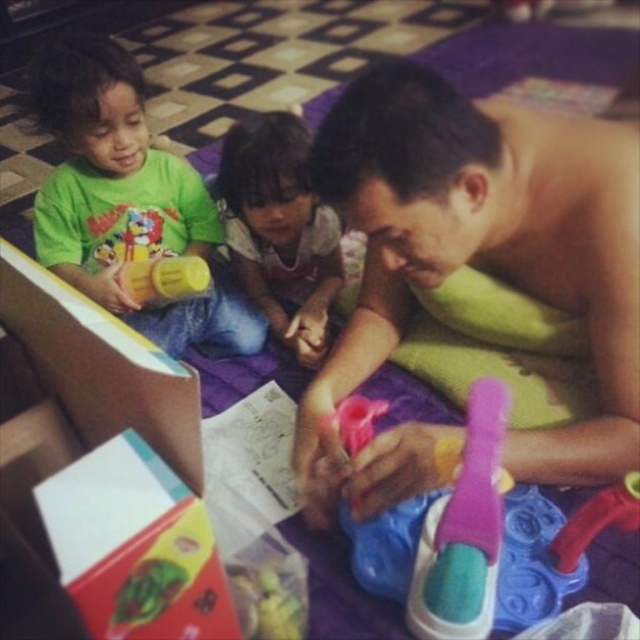
Question: Estimate the real-world distances between objects in this image. Which object is farther from the matte white shirt at center?

Choices:
 (A) matte green box at lower left
 (B) pink plastic toy at center

Answer: (A)

Question: Does matte green box at lower left have a larger size compared to pink rubber toothbrush at center?

Choices:
 (A) no
 (B) yes

Answer: (A)

Question: Which point is closer to the camera taking this photo?

Choices:
 (A) (291, 218)
 (B) (35, 486)

Answer: (B)

Question: Considering the relative positions of pink plastic brush at center and pink rubber toothbrush at center in the image provided, where is pink plastic brush at center located with respect to pink rubber toothbrush at center?

Choices:
 (A) right
 (B) left

Answer: (A)

Question: Which point is farther to the camera?

Choices:
 (A) (547, 317)
 (B) (531, 544)

Answer: (A)

Question: Is pink plastic brush at center thinner than pink plastic toy at center?

Choices:
 (A) yes
 (B) no

Answer: (B)